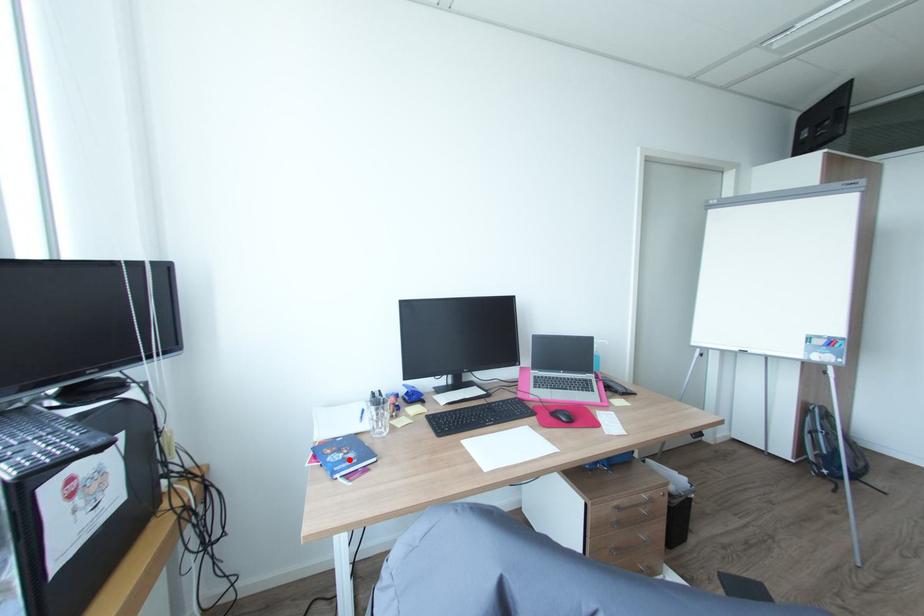
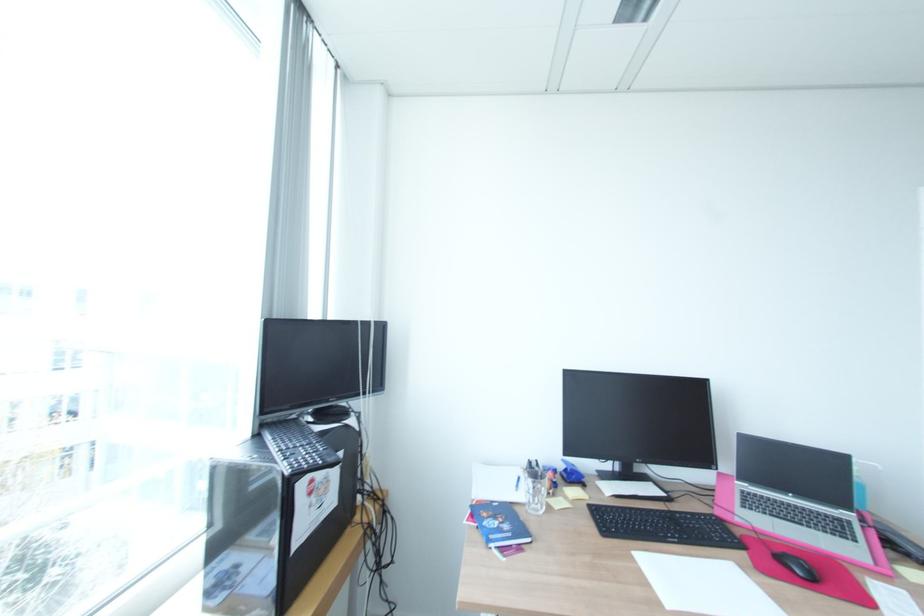
Where in the second image is the point corresponding to the highlighted location from the first image?

(504, 530)